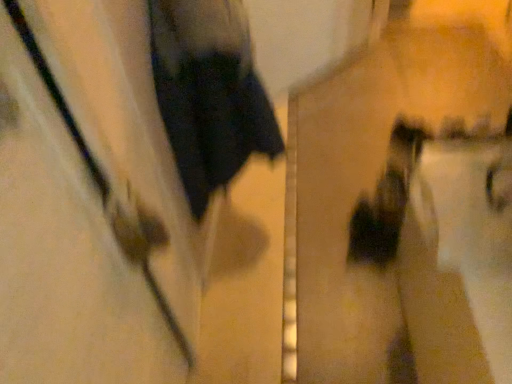
Identify the location of black matte cat at lower right. The height and width of the screenshot is (384, 512). (445, 252).

Describe the element at coordinates (445, 252) in the screenshot. The width and height of the screenshot is (512, 384). I see `black matte cat at lower right` at that location.

Based on the photo, what is the approximate width of black matte cat at lower right?

30.70 inches.

At what (x,y) coordinates should I click in order to perform the action: click on black matte cat at lower right. Please return your answer as a coordinate pair (x, y). The width and height of the screenshot is (512, 384). Looking at the image, I should click on (445, 252).